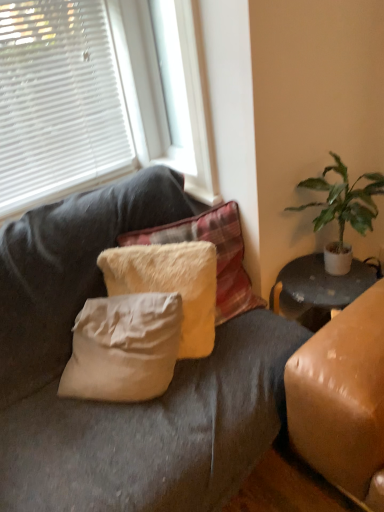
The width and height of the screenshot is (384, 512). I want to click on white blinds at upper left, so click(99, 98).

At what (x,y) coordinates should I click in order to perform the action: click on fuzzy white pillow at center, acting as the 1th pillow starting from the top. Please return your answer as a coordinate pair (x, y). Looking at the image, I should click on (216, 251).

You are a GUI agent. You are given a task and a screenshot of the screen. Output one action in this format:
    pyautogui.click(x=<x>, y=<y>)
    Task: Click on the fuzzy white pillow at center, acting as the second pillow starting from the top
    
    Given the screenshot: What is the action you would take?
    pyautogui.click(x=170, y=284)

In the image, is green leafy plant at right positioned in front of or behind fuzzy white pillow at center, marked as the 2th pillow in a bottom-to-top arrangement?

green leafy plant at right is in front of fuzzy white pillow at center, marked as the 2th pillow in a bottom-to-top arrangement.

Which is farther from the camera, [346,184] or [238,234]?

The point [238,234] is farther from the camera.

Consider the image. Is green leafy plant at right facing away from fuzzy white pillow at center, acting as the 1th pillow starting from the top?

No.

Between green leafy plant at right and white blinds at upper left, which one has larger size?

white blinds at upper left is bigger.

Is green leafy plant at right facing towards white blinds at upper left?

No, green leafy plant at right does not turn towards white blinds at upper left.

Is green leafy plant at right positioned beyond the bounds of white blinds at upper left?

green leafy plant at right lies outside white blinds at upper left's area.

Can you confirm if green leafy plant at right is thinner than white blinds at upper left?

No.

Would you consider fuzzy white pillow at center, the 1th pillow positioned from the bottom, to be distant from fuzzy white pillow at center, acting as the 1th pillow starting from the top?

fuzzy white pillow at center, the 1th pillow positioned from the bottom, is near fuzzy white pillow at center, acting as the 1th pillow starting from the top, not far away.

Based on the photo, does fuzzy white pillow at center, the 1th pillow positioned from the bottom, lie behind fuzzy white pillow at center, marked as the 2th pillow in a bottom-to-top arrangement?

That is False.

Can you confirm if fuzzy white pillow at center, the 1th pillow positioned from the bottom, is wider than fuzzy white pillow at center, acting as the 1th pillow starting from the top?

No.

From the image's perspective, which is below, white blinds at upper left or green leafy plant at right?

green leafy plant at right, from the image's perspective.

Looking at this image, is white blinds at upper left bigger or smaller than green leafy plant at right?

white blinds at upper left is bigger than green leafy plant at right.

Is white blinds at upper left positioned with its back to green leafy plant at right?

white blinds at upper left does not have its back to green leafy plant at right.

Does point (86, 42) come closer to viewer compared to point (377, 275)?

No, (86, 42) is further to viewer.

From a real-world perspective, is fuzzy white pillow at center, marked as the 2th pillow in a bottom-to-top arrangement, physically above white plastic window frame at upper center?

No.

Does fuzzy white pillow at center, marked as the 2th pillow in a bottom-to-top arrangement, contain white plastic window frame at upper center?

No, fuzzy white pillow at center, marked as the 2th pillow in a bottom-to-top arrangement, does not contain white plastic window frame at upper center.

Is fuzzy white pillow at center, acting as the 1th pillow starting from the top, positioned with its back to white plastic window frame at upper center?

No, fuzzy white pillow at center, acting as the 1th pillow starting from the top, is not facing the opposite direction of white plastic window frame at upper center.

Does fuzzy white pillow at center, the 1th pillow positioned from the bottom, appear on the left side of white blinds at upper left?

No.

Considering the relative sizes of fuzzy white pillow at center, the 1th pillow positioned from the bottom, and white blinds at upper left in the image provided, is fuzzy white pillow at center, the 1th pillow positioned from the bottom, taller than white blinds at upper left?

Incorrect, the height of fuzzy white pillow at center, the 1th pillow positioned from the bottom, is not larger of that of white blinds at upper left.

Find the location of a particular element. pillow that is the 2nd one when counting downward from the white blinds at upper left (from the image's perspective) is located at coordinates (170, 284).

How much distance is there between fuzzy white pillow at center, acting as the second pillow starting from the top, and white blinds at upper left?

fuzzy white pillow at center, acting as the second pillow starting from the top, and white blinds at upper left are 23.78 inches apart.

Is point (369, 200) less distant than point (174, 164)?

Yes, it is.

Is green leafy plant at right aimed at white plastic window frame at upper center?

No, green leafy plant at right is not aimed at white plastic window frame at upper center.

From the image's perspective, which is above, green leafy plant at right or white plastic window frame at upper center?

From the image's view, white plastic window frame at upper center is above.

Would you consider green leafy plant at right to be distant from white plastic window frame at upper center?

No, there isn't a large distance between green leafy plant at right and white plastic window frame at upper center.

The height and width of the screenshot is (512, 384). I want to click on pillow that is the 1st object directly below the green leafy plant at right (from a real-world perspective), so click(216, 251).

The height and width of the screenshot is (512, 384). Find the location of `houseplant that appears in front of the white blinds at upper left`. houseplant that appears in front of the white blinds at upper left is located at coordinates (343, 210).

Which object lies nearer to the anchor point white blinds at upper left, fuzzy white pillow at center, marked as the 2th pillow in a bottom-to-top arrangement, or fuzzy white pillow at center, the 1th pillow positioned from the bottom?

fuzzy white pillow at center, marked as the 2th pillow in a bottom-to-top arrangement.

Looking at the image, which one is located closer to white blinds at upper left, fuzzy white pillow at center, acting as the second pillow starting from the top, or green leafy plant at right?

fuzzy white pillow at center, acting as the second pillow starting from the top, is positioned closer to the anchor white blinds at upper left.

When comparing their distances from white plastic window frame at upper center, does fuzzy white pillow at center, acting as the 1th pillow starting from the top, or fuzzy white pillow at center, the 1th pillow positioned from the bottom, seem closer?

The object closer to white plastic window frame at upper center is fuzzy white pillow at center, acting as the 1th pillow starting from the top.

Looking at the image, which one is located further to green leafy plant at right, white plastic window frame at upper center or fuzzy white pillow at center, marked as the 2th pillow in a bottom-to-top arrangement?

Among the two, white plastic window frame at upper center is located further to green leafy plant at right.

Considering their positions, is white blinds at upper left positioned further to green leafy plant at right than fuzzy white pillow at center, marked as the 2th pillow in a bottom-to-top arrangement?

Among the two, white blinds at upper left is located further to green leafy plant at right.

From the image, which object appears to be nearer to fuzzy white pillow at center, acting as the second pillow starting from the top, fuzzy white pillow at center, acting as the 1th pillow starting from the top, or white plastic window frame at upper center?

fuzzy white pillow at center, acting as the 1th pillow starting from the top, is closer to fuzzy white pillow at center, acting as the second pillow starting from the top.

Looking at the image, which one is located closer to fuzzy white pillow at center, acting as the second pillow starting from the top, white blinds at upper left or green leafy plant at right?

Among the two, green leafy plant at right is located nearer to fuzzy white pillow at center, acting as the second pillow starting from the top.

From the image, which object appears to be nearer to fuzzy white pillow at center, acting as the second pillow starting from the top, fuzzy white pillow at center, marked as the 2th pillow in a bottom-to-top arrangement, or green leafy plant at right?

fuzzy white pillow at center, marked as the 2th pillow in a bottom-to-top arrangement.

What are the coordinates of `houseplant that lies between white plastic window frame at upper center and fuzzy white pillow at center, the 1th pillow positioned from the bottom, from top to bottom` in the screenshot? It's located at (343, 210).

At what (x,y) coordinates should I click in order to perform the action: click on window between white plastic window frame at upper center and fuzzy white pillow at center, acting as the second pillow starting from the top, vertically. Please return your answer as a coordinate pair (x, y). The image size is (384, 512). Looking at the image, I should click on (99, 98).

At what (x,y) coordinates should I click in order to perform the action: click on window frame between white blinds at upper left and green leafy plant at right in the horizontal direction. Please return your answer as a coordinate pair (x, y). The height and width of the screenshot is (512, 384). Looking at the image, I should click on click(x=185, y=97).

In order to click on pillow between white blinds at upper left and fuzzy white pillow at center, the 1th pillow positioned from the bottom, vertically in this screenshot , I will do `click(216, 251)`.